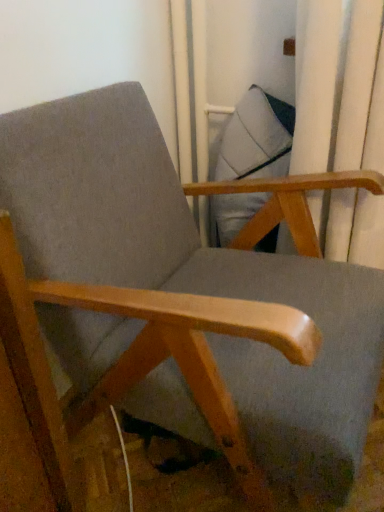
Measure the distance between point (284, 175) and camera.

1.15 meters.

In order to click on wooden swivel chair at upper center in this screenshot , I will do `click(256, 138)`.

What do you see at coordinates (256, 138) in the screenshot? The width and height of the screenshot is (384, 512). I see `wooden swivel chair at upper center` at bounding box center [256, 138].

At what (x,y) coordinates should I click in order to perform the action: click on wooden swivel chair at upper center. Please return your answer as a coordinate pair (x, y). Looking at the image, I should click on (256, 138).